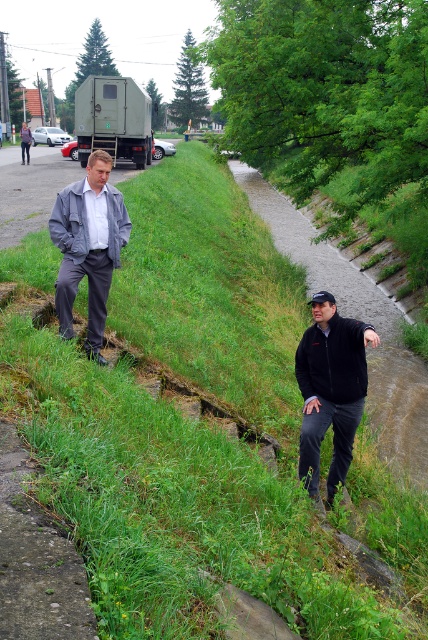
Between point (353, 321) and point (70, 324), which one is positioned in front?

Positioned in front is point (70, 324).

Is black fleece jacket at center in front of gray matte jacket at left?

Yes, it is in front of gray matte jacket at left.

You are a GUI agent. You are given a task and a screenshot of the screen. Output one action in this format:
    pyautogui.click(x=<x>, y=<y>)
    Task: Click on the black fleece jacket at center
    The height and width of the screenshot is (640, 428).
    Given the screenshot: What is the action you would take?
    pyautogui.click(x=330, y=388)